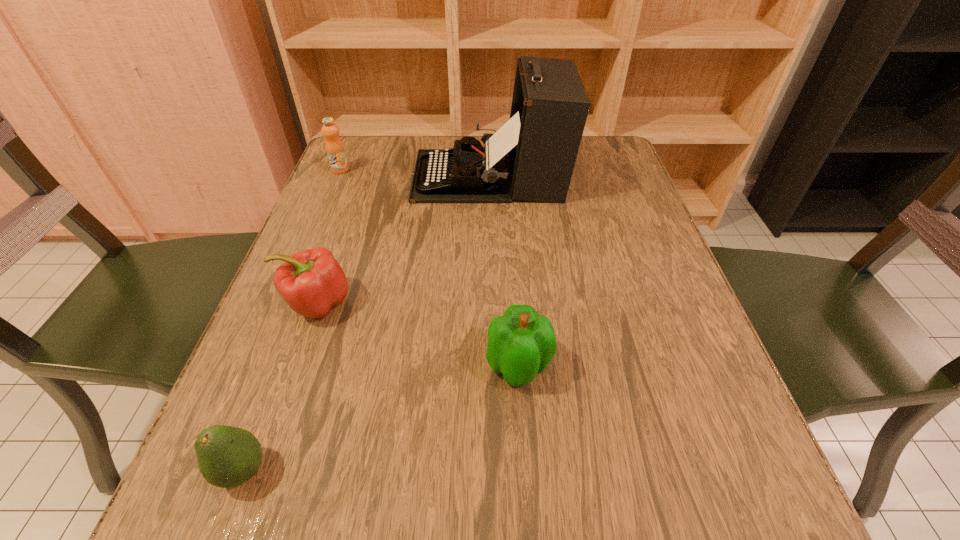
Where is `object located at the right edge`? The height and width of the screenshot is (540, 960). object located at the right edge is located at coordinates (531, 157).

Locate an element on the screen. object that is at the far left corner is located at coordinates (334, 147).

Locate an element on the screen. object located at the near left corner is located at coordinates (227, 456).

This screenshot has height=540, width=960. I want to click on object that is at the far right corner, so click(x=531, y=157).

This screenshot has width=960, height=540. Find the location of `vacant space at the near edge`. vacant space at the near edge is located at coordinates (467, 502).

I want to click on blank space at the left edge, so click(338, 344).

This screenshot has width=960, height=540. In order to click on free space at the right edge in this screenshot , I will do `click(662, 269)`.

Image resolution: width=960 pixels, height=540 pixels. I want to click on free space at the far left corner of the desktop, so click(x=376, y=180).

Where is `free space at the near right corner of the desktop`? Image resolution: width=960 pixels, height=540 pixels. free space at the near right corner of the desktop is located at coordinates click(676, 537).

This screenshot has width=960, height=540. In order to click on vacant area that lies between the orange juice and the fourth farthest object in this screenshot , I will do `click(429, 268)`.